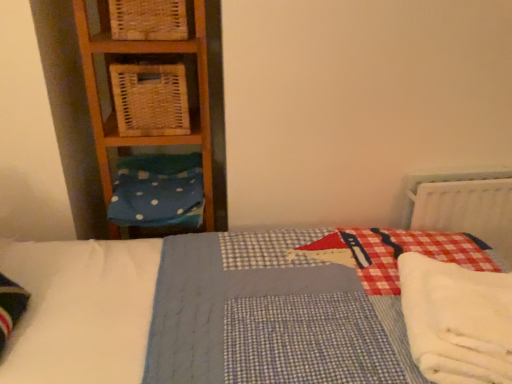
Question: Can woven wood basket at left, the second crate in the top-to-bottom sequence, be found inside blue polka dot fabric at left?

Choices:
 (A) no
 (B) yes

Answer: (A)

Question: Is blue polka dot fabric at left wider than woven wood basket at left, the 1th crate in the bottom-to-top sequence?

Choices:
 (A) no
 (B) yes

Answer: (B)

Question: Can you confirm if blue polka dot fabric at left is shorter than woven wood basket at left, the 1th crate in the bottom-to-top sequence?

Choices:
 (A) no
 (B) yes

Answer: (B)

Question: From a real-world perspective, is blue polka dot fabric at left physically above woven wood basket at left, the 1th crate in the bottom-to-top sequence?

Choices:
 (A) yes
 (B) no

Answer: (B)

Question: Is blue polka dot fabric at left next to woven wood basket at left, the second crate in the top-to-bottom sequence?

Choices:
 (A) no
 (B) yes

Answer: (A)

Question: Considering the positions of blue polka dot fabric at left and woven wood crate at upper left, acting as the 1th crate starting from the top, in the image, is blue polka dot fabric at left wider or thinner than woven wood crate at upper left, acting as the 1th crate starting from the top,?

Choices:
 (A) wide
 (B) thin

Answer: (A)

Question: Does point (189, 210) appear closer or farther from the camera than point (116, 36)?

Choices:
 (A) closer
 (B) farther

Answer: (B)

Question: From the image's perspective, is blue polka dot fabric at left positioned above or below woven wood crate at upper left, acting as the 1th crate starting from the top?

Choices:
 (A) above
 (B) below

Answer: (B)

Question: Which is correct: blue polka dot fabric at left is inside woven wood crate at upper left, arranged as the 2th crate when ordered from the bottom, or outside of it?

Choices:
 (A) outside
 (B) inside

Answer: (A)

Question: In terms of width, does woven wood crate at upper left, arranged as the 2th crate when ordered from the bottom, look wider or thinner when compared to blue polka dot fabric at left?

Choices:
 (A) thin
 (B) wide

Answer: (A)

Question: From the image's perspective, is woven wood crate at upper left, acting as the 1th crate starting from the top, positioned above or below blue polka dot fabric at left?

Choices:
 (A) below
 (B) above

Answer: (B)

Question: Is woven wood crate at upper left, acting as the 1th crate starting from the top, inside or outside of blue polka dot fabric at left?

Choices:
 (A) outside
 (B) inside

Answer: (A)

Question: From a real-world perspective, is woven wood crate at upper left, arranged as the 2th crate when ordered from the bottom, physically located above or below blue polka dot fabric at left?

Choices:
 (A) below
 (B) above

Answer: (B)

Question: Considering their positions, is white fluffy blanket at lower right located in front of or behind woven wood basket at left, the 1th crate in the bottom-to-top sequence?

Choices:
 (A) behind
 (B) front

Answer: (B)

Question: Visually, is white fluffy blanket at lower right positioned to the left or to the right of woven wood basket at left, the 1th crate in the bottom-to-top sequence?

Choices:
 (A) left
 (B) right

Answer: (B)